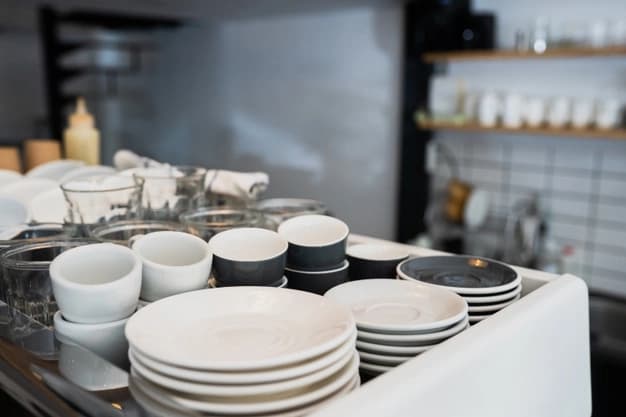
This screenshot has width=626, height=417. I want to click on cup saucer, so click(387, 319), click(387, 337), click(398, 347), click(387, 359), click(377, 369), click(483, 283), click(488, 296), click(481, 308), click(473, 315).